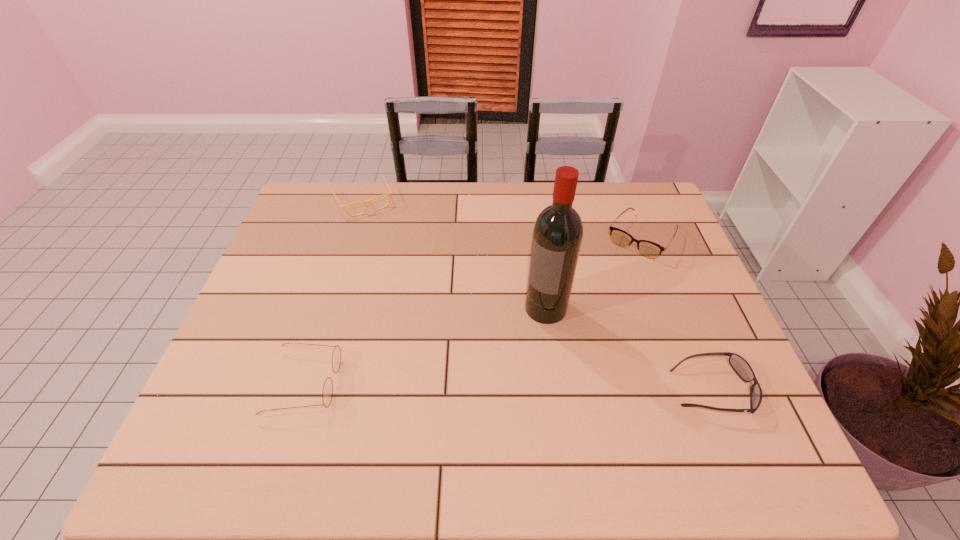
You are a GUI agent. You are given a task and a screenshot of the screen. Output one action in this format:
    pyautogui.click(x=<x>, y=<y>)
    Task: Click on the free space between the rightmost spectacles and the sunglasses
    This screenshot has height=540, width=960.
    Given the screenshot: What is the action you would take?
    pyautogui.click(x=677, y=313)

You are a GUI agent. You are given a task and a screenshot of the screen. Output one action in this format:
    pyautogui.click(x=<x>, y=<y>)
    Task: Click on the vacant space in between the rightmost spectacles and the third object from left to right
    The image size is (960, 540).
    Given the screenshot: What is the action you would take?
    pyautogui.click(x=593, y=272)

The width and height of the screenshot is (960, 540). In order to click on object identified as the second closest to the rightmost spectacles in this screenshot , I will do `click(742, 368)`.

Identify the location of object that is the second closest to the nearest spectacles. This screenshot has width=960, height=540. (365, 202).

Identify which spectacles is the closest to the rightmost spectacles. Please provide its 2D coordinates. Your answer should be formatted as a tuple, i.e. [(x, y)], where the tuple contains the x and y coordinates of a point satisfying the conditions above.

[(365, 202)]

Select which spectacles appears as the second closest to the sunglasses. Please provide its 2D coordinates. Your answer should be formatted as a tuple, i.e. [(x, y)], where the tuple contains the x and y coordinates of a point satisfying the conditions above.

[(327, 393)]

I want to click on vacant space that satisfies the following two spatial constraints: 1. on the front side of the third farthest object; 2. on the lenses of the sunglasses, so click(x=557, y=390).

I want to click on free space that satisfies the following two spatial constraints: 1. on the front side of the wine bottle; 2. on the lenses of the sunglasses, so click(557, 390).